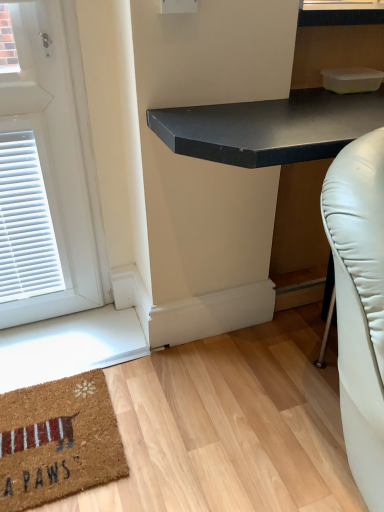
This screenshot has width=384, height=512. What do you see at coordinates (58, 441) in the screenshot? I see `brown coir mat at lower left` at bounding box center [58, 441].

You are a GUI agent. You are given a task and a screenshot of the screen. Output one action in this format:
    pyautogui.click(x=<x>, y=<y>)
    Task: Click on the brown coir mat at lower left
    The height and width of the screenshot is (512, 384).
    Given the screenshot: What is the action you would take?
    pyautogui.click(x=58, y=441)

Measure the distance between black matte desk at center and camera.

black matte desk at center and camera are 30.26 inches apart from each other.

You are a GUI agent. You are given a task and a screenshot of the screen. Output one action in this format:
    pyautogui.click(x=<x>, y=<y>)
    Task: Click on the black matte desk at center
    The height and width of the screenshot is (512, 384).
    Given the screenshot: What is the action you would take?
    pyautogui.click(x=270, y=127)

What do you see at coordinates (270, 127) in the screenshot?
I see `black matte desk at center` at bounding box center [270, 127].

Locate an element on the screen. brown coir mat at lower left is located at coordinates tap(58, 441).

Considering the relative positions of black matte desk at center and brown coir mat at lower left in the image provided, is black matte desk at center to the right of brown coir mat at lower left from the viewer's perspective?

Yes, black matte desk at center is to the right of brown coir mat at lower left.

Is black matte desk at center in front of or behind brown coir mat at lower left in the image?

black matte desk at center is positioned closer to the viewer than brown coir mat at lower left.

Considering the positions of point (310, 139) and point (112, 468), is point (310, 139) closer or farther from the camera than point (112, 468)?

Point (310, 139) is positioned closer to the camera compared to point (112, 468).

From the image's perspective, is black matte desk at center on top of brown coir mat at lower left?

Indeed, from the image's perspective, black matte desk at center is shown above brown coir mat at lower left.

From a real-world perspective, who is located lower, black matte desk at center or brown coir mat at lower left?

From a 3D spatial view, brown coir mat at lower left is below.

Considering the sizes of objects black matte desk at center and brown coir mat at lower left in the image provided, who is wider, black matte desk at center or brown coir mat at lower left?

With larger width is black matte desk at center.

Who is taller, black matte desk at center or brown coir mat at lower left?

black matte desk at center.

Considering the relative sizes of black matte desk at center and brown coir mat at lower left in the image provided, is black matte desk at center bigger than brown coir mat at lower left?

Correct, black matte desk at center is larger in size than brown coir mat at lower left.

In the scene shown: Is brown coir mat at lower left a part of black matte desk at center?

No, brown coir mat at lower left is located outside of black matte desk at center.

Consider the image. Are black matte desk at center and brown coir mat at lower left located far from each other?

No, black matte desk at center is not far away from brown coir mat at lower left.

Is black matte desk at center turned away from brown coir mat at lower left?

No, black matte desk at center is not facing the opposite direction of brown coir mat at lower left.

What's the angular difference between black matte desk at center and brown coir mat at lower left's facing directions?

The angle between the facing direction of black matte desk at center and the facing direction of brown coir mat at lower left is 0.0968 degrees.

You are a GUI agent. You are given a task and a screenshot of the screen. Output one action in this format:
    pyautogui.click(x=<x>, y=<y>)
    Task: Click on the mat on the left of black matte desk at center
    The image size is (384, 512).
    Given the screenshot: What is the action you would take?
    pyautogui.click(x=58, y=441)

Considering the relative positions of brown coir mat at lower left and black matte desk at center in the image provided, is brown coir mat at lower left to the right of black matte desk at center from the viewer's perspective?

No, brown coir mat at lower left is not to the right of black matte desk at center.

Is the depth of brown coir mat at lower left greater than that of black matte desk at center?

Yes, brown coir mat at lower left is further from the viewer.

Considering the points (107, 474) and (169, 108), which point is behind, point (107, 474) or point (169, 108)?

The point (107, 474) is farther.

From the image's perspective, does brown coir mat at lower left appear lower than black matte desk at center?

Indeed, from the image's perspective, brown coir mat at lower left is shown beneath black matte desk at center.

From a real-world perspective, is brown coir mat at lower left located beneath black matte desk at center?

Yes.

In terms of width, does brown coir mat at lower left look wider or thinner when compared to black matte desk at center?

Clearly, brown coir mat at lower left has less width compared to black matte desk at center.

Is brown coir mat at lower left taller than black matte desk at center?

In fact, brown coir mat at lower left may be shorter than black matte desk at center.

Considering the sizes of brown coir mat at lower left and black matte desk at center in the image, is brown coir mat at lower left bigger or smaller than black matte desk at center?

Considering their sizes, brown coir mat at lower left takes up less space than black matte desk at center.

Is brown coir mat at lower left situated inside black matte desk at center or outside?

The correct answer is: outside.

Are brown coir mat at lower left and black matte desk at center beside each other?

No.

Is brown coir mat at lower left turned away from black matte desk at center?

No, brown coir mat at lower left is not facing away from black matte desk at center.

Locate an element on the screen. table that appears on the right of brown coir mat at lower left is located at coordinates (270, 127).

Locate an element on the screen. Image resolution: width=384 pixels, height=512 pixels. mat that appears below the black matte desk at center (from a real-world perspective) is located at coordinates (58, 441).

You are a GUI agent. You are given a task and a screenshot of the screen. Output one action in this format:
    pyautogui.click(x=<x>, y=<y>)
    Task: Click on the mat lying below the black matte desk at center (from the image's perspective)
    The image size is (384, 512).
    Given the screenshot: What is the action you would take?
    pyautogui.click(x=58, y=441)